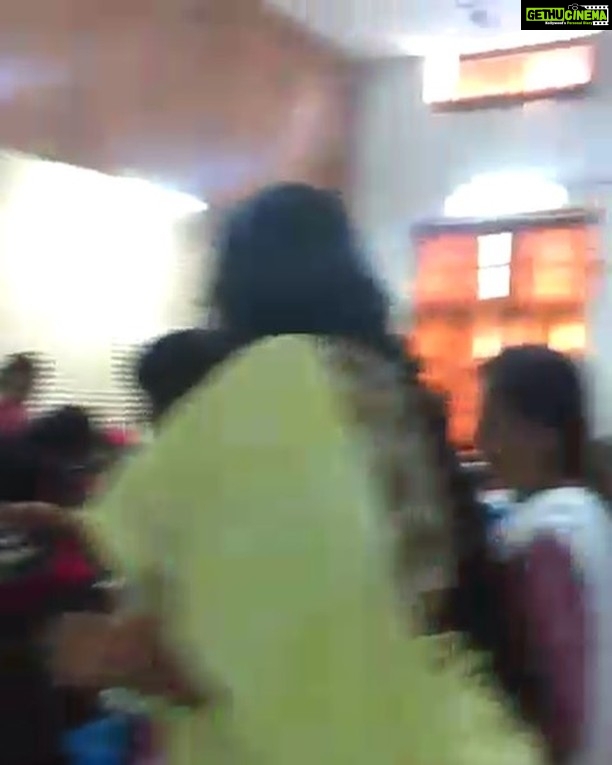
At what (x,y) coordinates should I click in order to perform the action: click on ceiling. Please return your answer as a coordinate pair (x, y). The image size is (612, 765). Looking at the image, I should click on (382, 31).